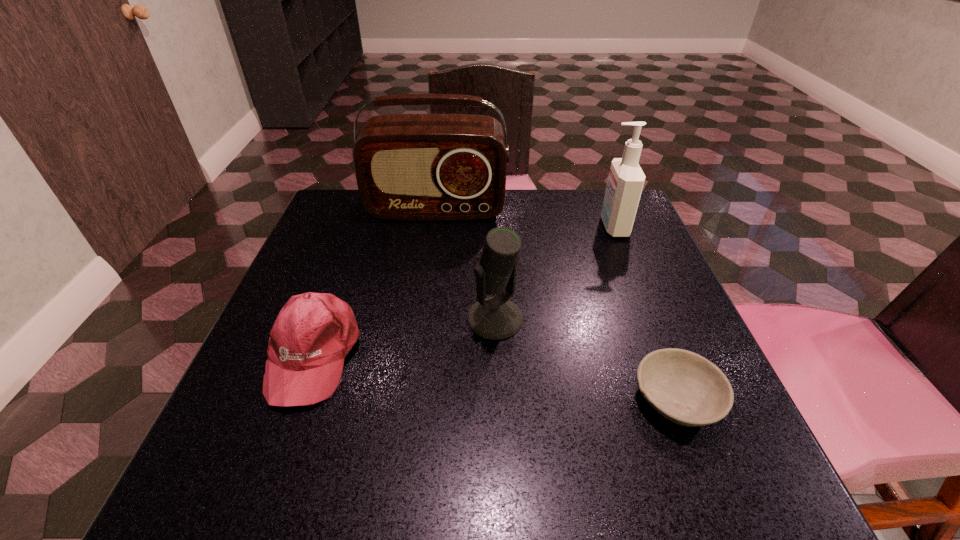
The width and height of the screenshot is (960, 540). I want to click on radio receiver, so click(x=417, y=167).

Locate an element on the screen. This screenshot has height=540, width=960. cleansing agent is located at coordinates (626, 179).

The height and width of the screenshot is (540, 960). I want to click on microphone, so click(x=495, y=318).

Image resolution: width=960 pixels, height=540 pixels. What are the coordinates of `the fourth tallest object` in the screenshot? It's located at (313, 333).

Locate an element on the screen. This screenshot has height=540, width=960. the shortest object is located at coordinates (684, 387).

Locate an element on the screen. The width and height of the screenshot is (960, 540). vacant area situated 0.230m on the front panel of the radio receiver is located at coordinates (426, 283).

At what (x,y) coordinates should I click in order to perform the action: click on vacant region located on the front label of the cleansing agent. Please return your answer as a coordinate pair (x, y). This screenshot has height=540, width=960. Looking at the image, I should click on (552, 227).

Where is `free spot located on the front label of the cleansing agent`? Image resolution: width=960 pixels, height=540 pixels. free spot located on the front label of the cleansing agent is located at coordinates (536, 227).

Locate an element on the screen. This screenshot has height=540, width=960. vacant space located 0.160m on the front label of the cleansing agent is located at coordinates (536, 227).

This screenshot has width=960, height=540. Identify the location of free space located 0.270m on the back of the third shortest object. (492, 225).